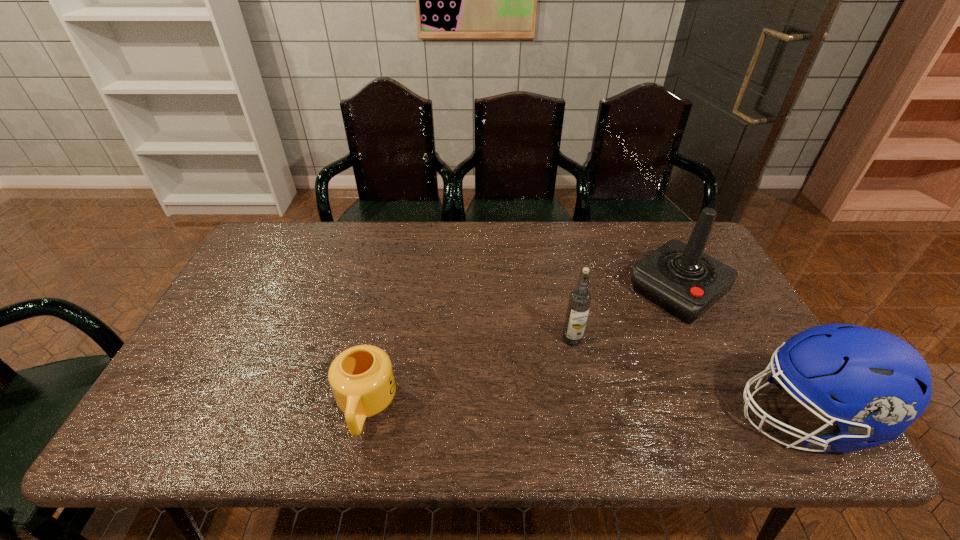
I want to click on free space at the near edge, so coord(396,394).

Where is `vacant region at the left edge`? The image size is (960, 540). vacant region at the left edge is located at coordinates (261, 273).

I want to click on free space at the right edge of the desktop, so click(x=720, y=334).

At what (x,y) coordinates should I click in order to perform the action: click on vacant space in between the football helmet and the shortest object. Please return your answer as a coordinate pair (x, y). Looking at the image, I should click on (585, 412).

You are a GUI agent. You are given a task and a screenshot of the screen. Output one action in this format:
    pyautogui.click(x=<x>, y=<y>)
    Task: Click on the unoccupied area between the leftmost object and the football helmet
    Image resolution: width=960 pixels, height=540 pixels.
    Given the screenshot: What is the action you would take?
    pyautogui.click(x=585, y=412)

Identify the location of free spot between the farthest object and the mug. (521, 349).

In order to click on empty location between the leftmost object and the football helmet in this screenshot , I will do `click(585, 412)`.

Find the location of a particular element. free space between the football helmet and the third object from right to left is located at coordinates (687, 379).

The height and width of the screenshot is (540, 960). I want to click on free space between the football helmet and the third object from right to left, so click(687, 379).

Locate an element on the screen. Image resolution: width=960 pixels, height=540 pixels. vacant area that lies between the joystick and the vodka is located at coordinates (624, 316).